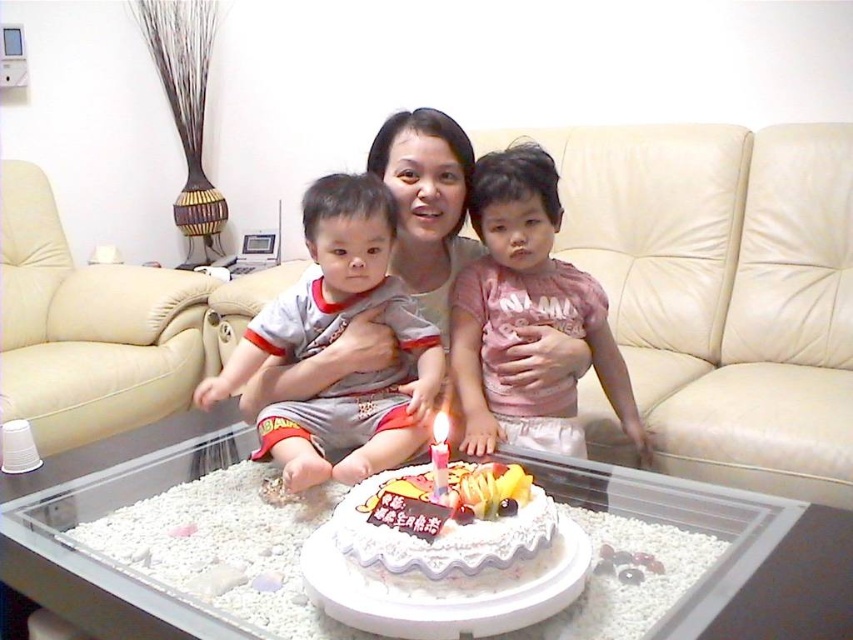
Question: Among these objects, which one is nearest to the camera?

Choices:
 (A) pink cotton shirt at center
 (B) beige leather couch at left
 (C) white wax candle at center

Answer: (C)

Question: Does beige leather couch at left appear on the right side of pink cotton shirt at center?

Choices:
 (A) no
 (B) yes

Answer: (A)

Question: From the image, what is the correct spatial relationship of beige leather couch at center in relation to gray cotton shirt at center?

Choices:
 (A) left
 (B) right

Answer: (B)

Question: Which object appears farthest from the camera in this image?

Choices:
 (A) pink cotton shirt at center
 (B) beige leather couch at center
 (C) white wax candle at center
 (D) beige leather couch at left

Answer: (D)

Question: Which object is closer to the camera taking this photo?

Choices:
 (A) gray cotton shirt at center
 (B) beige leather couch at left
 (C) pink cotton shirt at center

Answer: (A)

Question: Does gray cotton shirt at center appear over white wax candle at center?

Choices:
 (A) yes
 (B) no

Answer: (A)